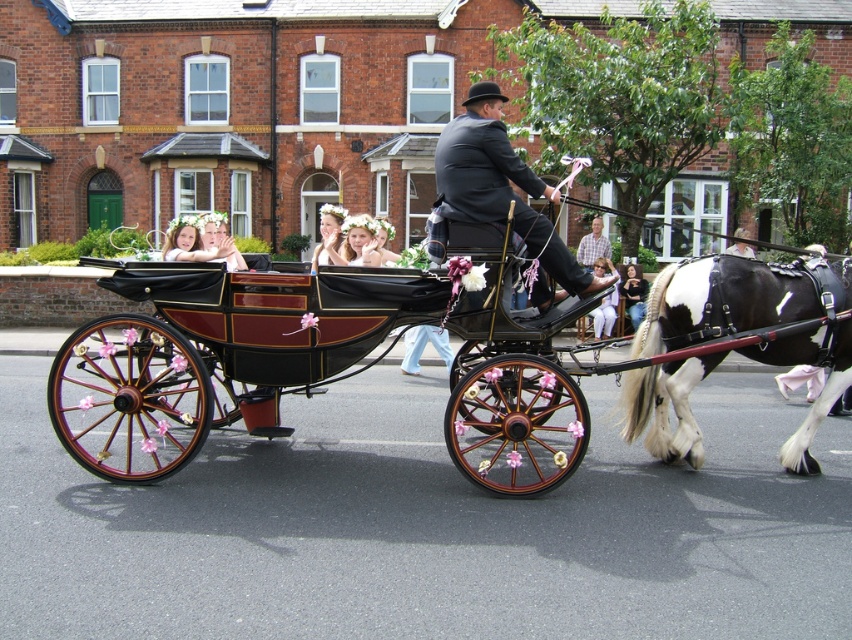
You are a photographer trying to capture a photo of the white cotton dress at center and the black and white speckled horse at right. You want to ensure both subjects are fully visible in your shot. Given that your camera has a fixed width of 1 meter, will you need to adjust your position to accommodate both subjects?

The black and white speckled horse at right is narrower than the white cotton dress at center. Since the camera has a fixed width of 1 meter, and the horse is narrower, you can position the camera so that both subjects fit within the frame without needing to adjust your position further, provided their combined width does not exceed 1 meter.

You are a photographer standing on the sidewalk. You want to take a photo of the shiny black coach at center and the white cotton dress at center. Which object should you focus on first if you want to capture both in one shot without moving the camera?

The shiny black coach at center is much taller than the white cotton dress at center, so you should focus on the shiny black coach at center first to ensure it is in frame before the white cotton dress at center.